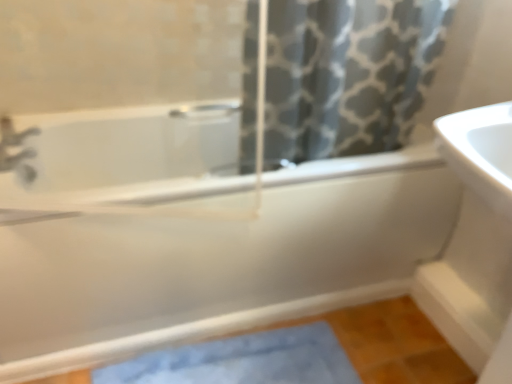
Find the location of `gray printed fabric at upper center`. gray printed fabric at upper center is located at coordinates (348, 74).

What is the approximate width of blue fabric bath mat at lower center?

It is 31.07 centimeters.

The width and height of the screenshot is (512, 384). I want to click on matte silver faucet at upper left, so click(x=16, y=146).

The width and height of the screenshot is (512, 384). I want to click on gray printed fabric at upper center, so click(348, 74).

Is matte silver faucet at upper left inside or outside of gray printed fabric at upper center?

matte silver faucet at upper left is located beyond the bounds of gray printed fabric at upper center.

Relative to gray printed fabric at upper center, is matte silver faucet at upper left in front or behind?

Visually, matte silver faucet at upper left is located behind gray printed fabric at upper center.

Which object is wider, matte silver faucet at upper left or gray printed fabric at upper center?

gray printed fabric at upper center is wider.

From the picture: From the image's perspective, is white glossy sink at right above blue fabric bath mat at lower center?

Yes.

Which of these two, white glossy sink at right or blue fabric bath mat at lower center, stands taller?

With more height is white glossy sink at right.

How much distance is there between white glossy sink at right and blue fabric bath mat at lower center?

white glossy sink at right and blue fabric bath mat at lower center are 26.36 inches apart.

From the picture: Do you think white glossy sink at right is within blue fabric bath mat at lower center, or outside of it?

white glossy sink at right is spatially situated outside blue fabric bath mat at lower center.

Which is closer to the camera, (353,19) or (23,168)?

Clearly, point (353,19) is closer to the camera than point (23,168).

Is gray printed fabric at upper center at the left side of matte silver faucet at upper left?

No, gray printed fabric at upper center is not to the left of matte silver faucet at upper left.

Does gray printed fabric at upper center have a greater height compared to matte silver faucet at upper left?

Yes, gray printed fabric at upper center is taller than matte silver faucet at upper left.

Is gray printed fabric at upper center outside of matte silver faucet at upper left?

That's correct, gray printed fabric at upper center is outside of matte silver faucet at upper left.

Does matte silver faucet at upper left come behind white glossy sink at right?

Yes, it is.

Based on the photo, from the image's perspective, relative to white glossy sink at right, is matte silver faucet at upper left above or below?

matte silver faucet at upper left is situated higher than white glossy sink at right in the image.

Is matte silver faucet at upper left in contact with white glossy sink at right?

matte silver faucet at upper left is not next to white glossy sink at right, and they're not touching.

Considering the relative sizes of matte silver faucet at upper left and white glossy sink at right in the image provided, is matte silver faucet at upper left smaller than white glossy sink at right?

Correct, matte silver faucet at upper left occupies less space than white glossy sink at right.

Can you confirm if white glossy sink at right is smaller than matte silver faucet at upper left?

Incorrect, white glossy sink at right is not smaller in size than matte silver faucet at upper left.

From a real-world perspective, is white glossy sink at right physically below matte silver faucet at upper left?

No, from a real-world perspective, white glossy sink at right is not beneath matte silver faucet at upper left.

In the scene shown: Considering the sizes of white glossy sink at right and matte silver faucet at upper left in the image, is white glossy sink at right taller or shorter than matte silver faucet at upper left?

Considering their sizes, white glossy sink at right has more height than matte silver faucet at upper left.

Can you confirm if white glossy sink at right is positioned to the right of matte silver faucet at upper left?

Correct, you'll find white glossy sink at right to the right of matte silver faucet at upper left.

Which is closer to the camera, (292, 258) or (399, 72)?

The point (399, 72) is closer.

Can you tell me how much white glossy bathtub at center and gray printed fabric at upper center differ in facing direction?

0.263 degrees.

From a real-world perspective, who is located lower, white glossy bathtub at center or gray printed fabric at upper center?

white glossy bathtub at center is physically lower.

Consider the image. Is white glossy bathtub at center oriented away from gray printed fabric at upper center?

No, white glossy bathtub at center's orientation is not away from gray printed fabric at upper center.

Considering the relative sizes of white glossy bathtub at center and blue fabric bath mat at lower center in the image provided, is white glossy bathtub at center wider than blue fabric bath mat at lower center?

Yes, white glossy bathtub at center is wider than blue fabric bath mat at lower center.

From a real-world perspective, is white glossy bathtub at center positioned under blue fabric bath mat at lower center based on gravity?

No, from a real-world perspective, white glossy bathtub at center is not under blue fabric bath mat at lower center.

Would you say white glossy bathtub at center is to the left or to the right of blue fabric bath mat at lower center in the picture?

white glossy bathtub at center is positioned on blue fabric bath mat at lower center's left side.

How many degrees apart are the facing directions of white glossy bathtub at center and blue fabric bath mat at lower center?

The facing directions of white glossy bathtub at center and blue fabric bath mat at lower center are 3.15 degrees apart.

Identify the location of shower curtain in front of the matte silver faucet at upper left. Image resolution: width=512 pixels, height=384 pixels. (348, 74).

Where is `sink positioned vertically above the blue fabric bath mat at lower center (from a real-world perspective)`? Image resolution: width=512 pixels, height=384 pixels. sink positioned vertically above the blue fabric bath mat at lower center (from a real-world perspective) is located at coordinates (482, 206).

Which object lies nearer to the anchor point blue fabric bath mat at lower center, gray printed fabric at upper center or matte silver faucet at upper left?

gray printed fabric at upper center is closer to blue fabric bath mat at lower center.

From the image, which object appears to be farther from white glossy sink at right, matte silver faucet at upper left or blue fabric bath mat at lower center?

matte silver faucet at upper left lies further to white glossy sink at right than the other object.

Consider the image. Looking at the image, which one is located closer to blue fabric bath mat at lower center, white glossy bathtub at center or matte silver faucet at upper left?

Based on the image, white glossy bathtub at center appears to be nearer to blue fabric bath mat at lower center.

Looking at the image, which one is located further to white glossy bathtub at center, gray printed fabric at upper center or matte silver faucet at upper left?

The object further to white glossy bathtub at center is matte silver faucet at upper left.

Based on their spatial positions, is gray printed fabric at upper center or white glossy sink at right closer to white glossy bathtub at center?

gray printed fabric at upper center.

Based on their spatial positions, is blue fabric bath mat at lower center or gray printed fabric at upper center further from white glossy sink at right?

blue fabric bath mat at lower center lies further to white glossy sink at right than the other object.

Estimate the real-world distances between objects in this image. Which object is closer to gray printed fabric at upper center, matte silver faucet at upper left or white glossy sink at right?

white glossy sink at right is positioned closer to the anchor gray printed fabric at upper center.

Estimate the real-world distances between objects in this image. Which object is closer to gray printed fabric at upper center, white glossy sink at right or blue fabric bath mat at lower center?

white glossy sink at right is closer to gray printed fabric at upper center.

The width and height of the screenshot is (512, 384). Identify the location of bathtub between matte silver faucet at upper left and blue fabric bath mat at lower center from top to bottom. [x=217, y=262].

At what (x,y) coordinates should I click in order to perform the action: click on bath mat between matte silver faucet at upper left and gray printed fabric at upper center. Please return your answer as a coordinate pair (x, y). Looking at the image, I should click on (243, 361).

You are a GUI agent. You are given a task and a screenshot of the screen. Output one action in this format:
    pyautogui.click(x=<x>, y=<y>)
    Task: Click on the shower curtain situated between matte silver faucet at upper left and white glossy sink at right from left to right
    The image size is (512, 384).
    Given the screenshot: What is the action you would take?
    pyautogui.click(x=348, y=74)

Where is `shower curtain between white glossy bathtub at center and white glossy sink at right from left to right`? This screenshot has height=384, width=512. shower curtain between white glossy bathtub at center and white glossy sink at right from left to right is located at coordinates (348, 74).